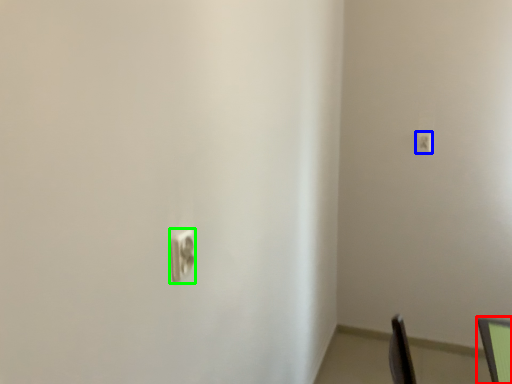
Question: Which object is the closest to the computer monitor (highlighted by a red box)? Choose among these: light switch (highlighted by a blue box) or light switch (highlighted by a green box).

Choices:
 (A) light switch
 (B) light switch

Answer: (B)